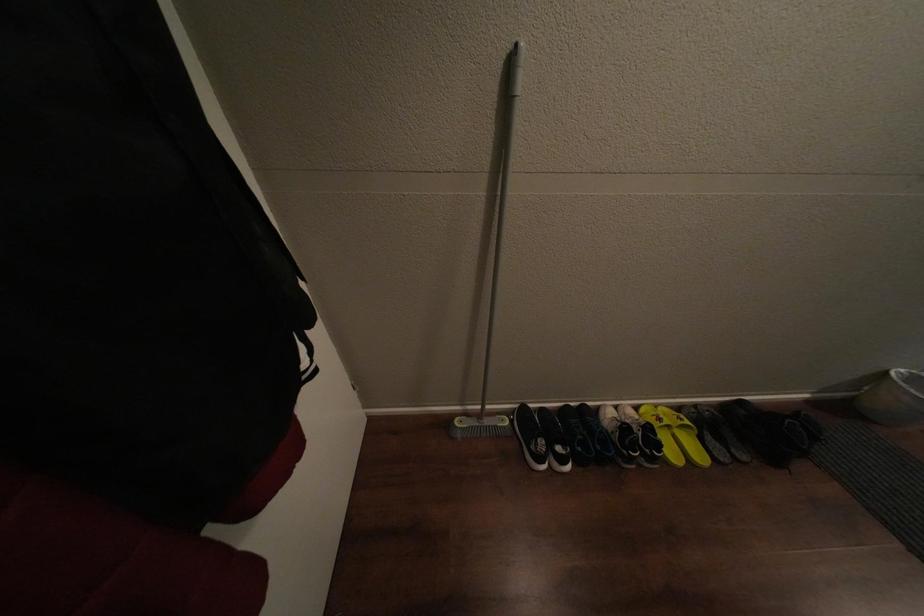
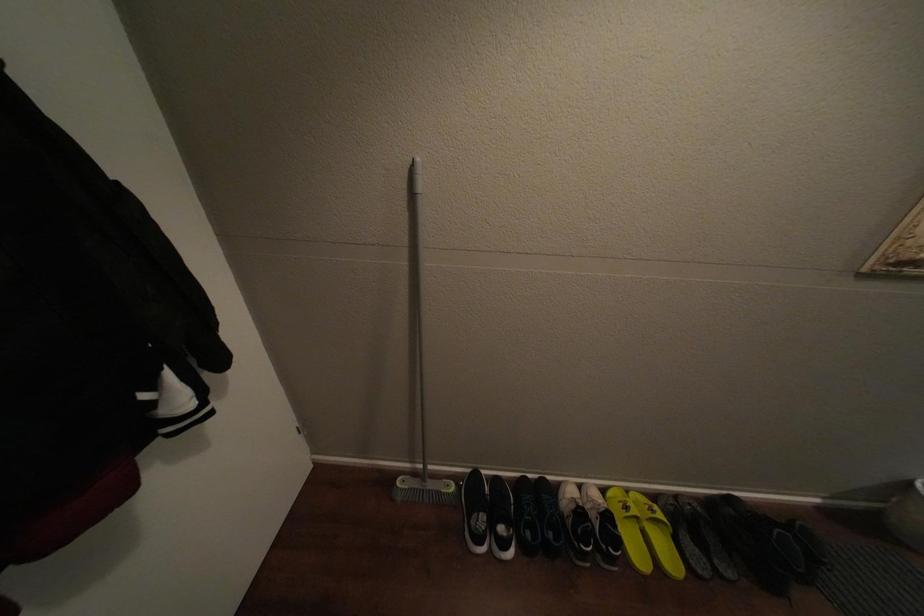
Question: The images are taken continuously from a first-person perspective. In which direction is your viewpoint rotating?

Choices:
 (A) Left
 (B) Right
 (C) Up
 (D) Down

Answer: (C)